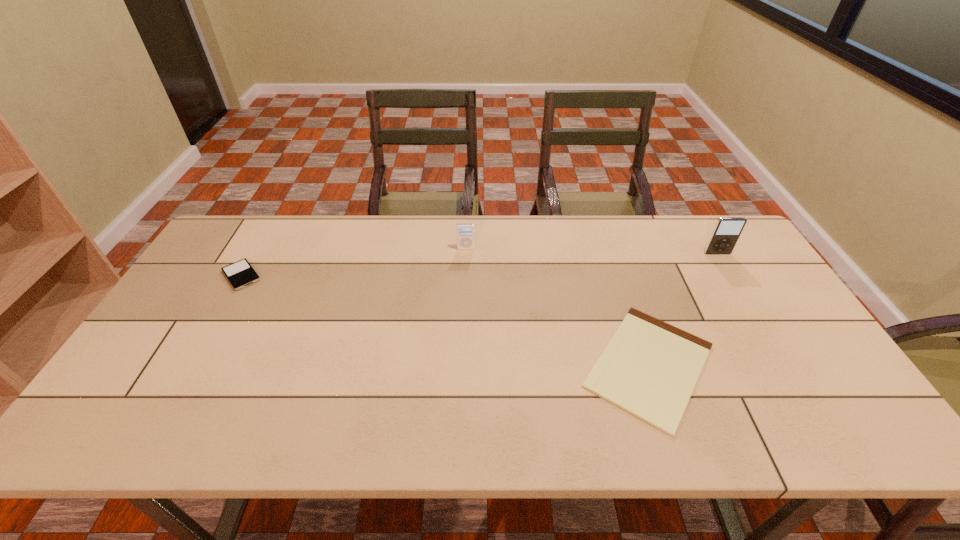
I want to click on the tallest iPod, so (725, 235).

Find the location of a particular element. the second farthest iPod is located at coordinates (725, 235).

The width and height of the screenshot is (960, 540). In order to click on the third shortest object in this screenshot , I will do `click(465, 231)`.

Image resolution: width=960 pixels, height=540 pixels. Find the location of `the second iPod from left to right`. the second iPod from left to right is located at coordinates (465, 231).

Find the location of a particular element. The image size is (960, 540). the third tallest object is located at coordinates (240, 274).

You are a GUI agent. You are given a task and a screenshot of the screen. Output one action in this format:
    pyautogui.click(x=<x>, y=<y>)
    Task: Click on the leftmost object
    
    Given the screenshot: What is the action you would take?
    pyautogui.click(x=240, y=274)

The height and width of the screenshot is (540, 960). Find the location of `clipboard`. clipboard is located at coordinates (649, 369).

Where is `the third object from left to right`? The width and height of the screenshot is (960, 540). the third object from left to right is located at coordinates (649, 369).

Where is `vacant space located on the front-facing side of the rightmost object`? The image size is (960, 540). vacant space located on the front-facing side of the rightmost object is located at coordinates (733, 280).

This screenshot has width=960, height=540. I want to click on vacant region located 0.080m on the front-facing side of the second shortest iPod, so click(x=466, y=266).